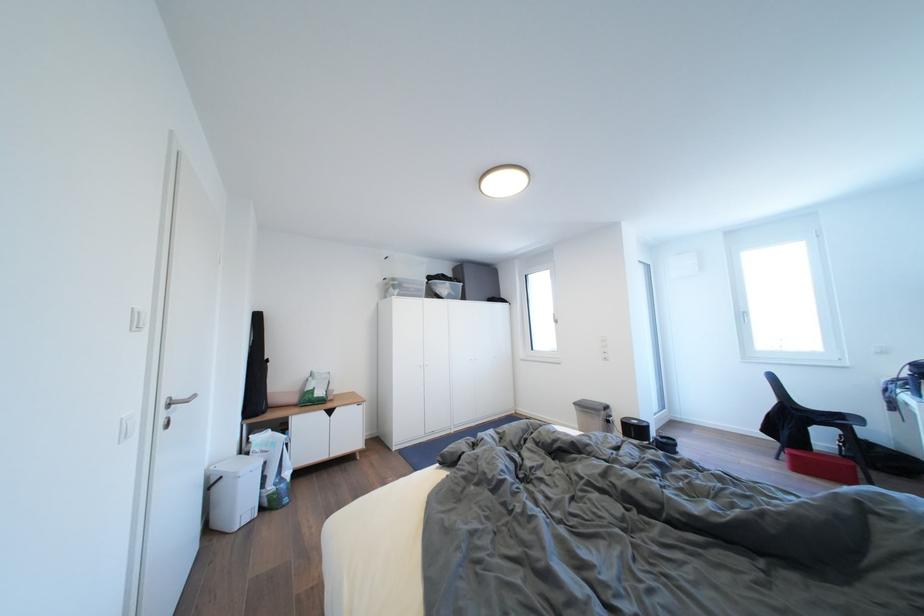
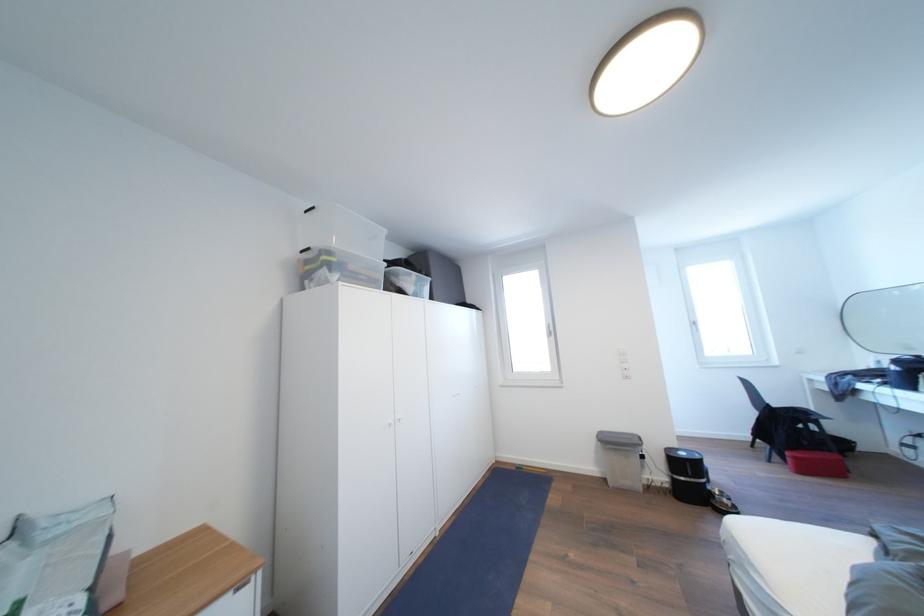
Find the pixel in the second image that matches point (642, 427) in the first image.

(689, 459)